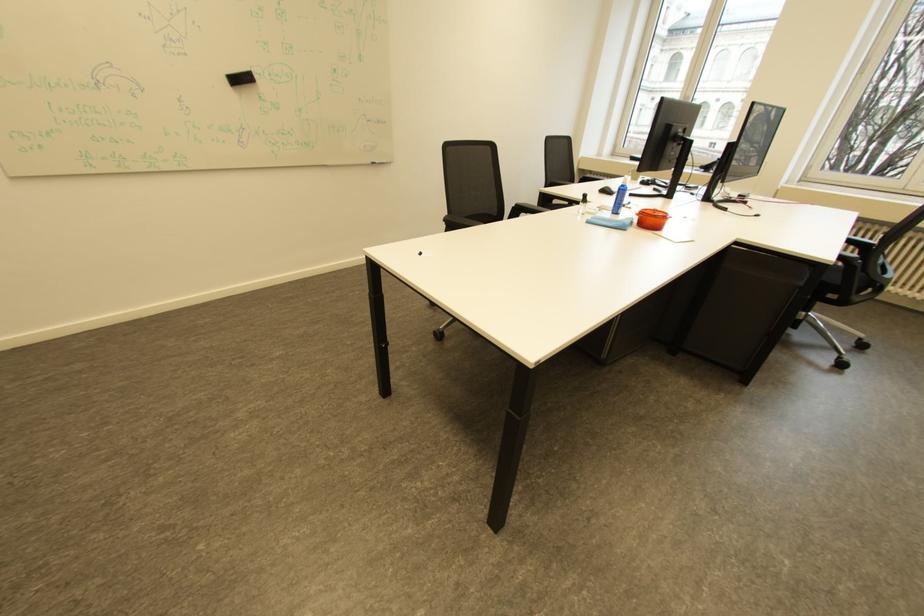
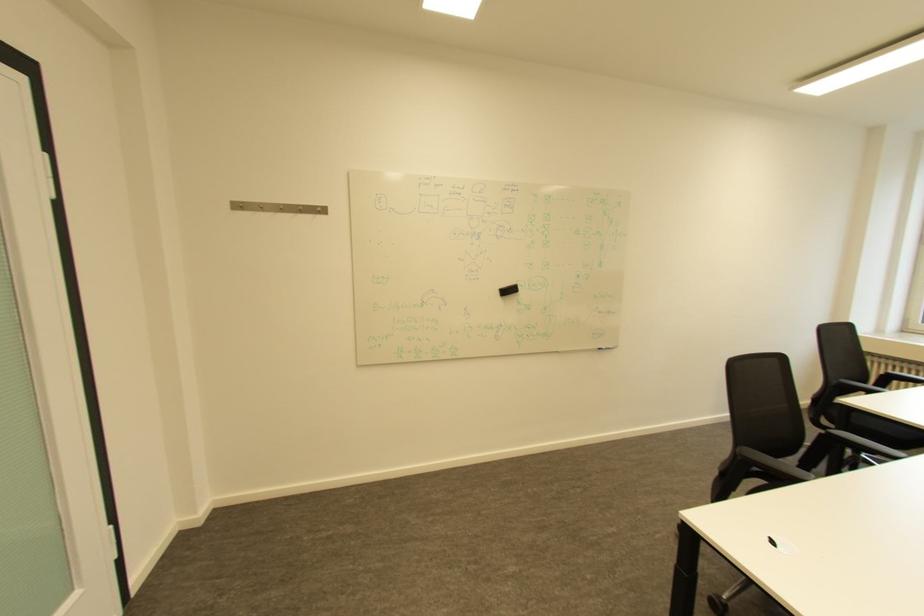
First-person continuous shooting, in which direction is the camera rotating?

The camera's rotation is toward left-up.